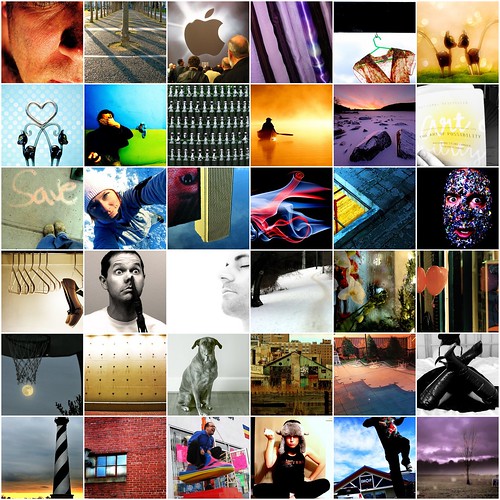
Where is `pictures in top row`? This screenshot has height=500, width=500. pictures in top row is located at coordinates [x=49, y=51], [x=115, y=45], [x=199, y=46], [x=287, y=44], [x=364, y=47], [x=442, y=48].